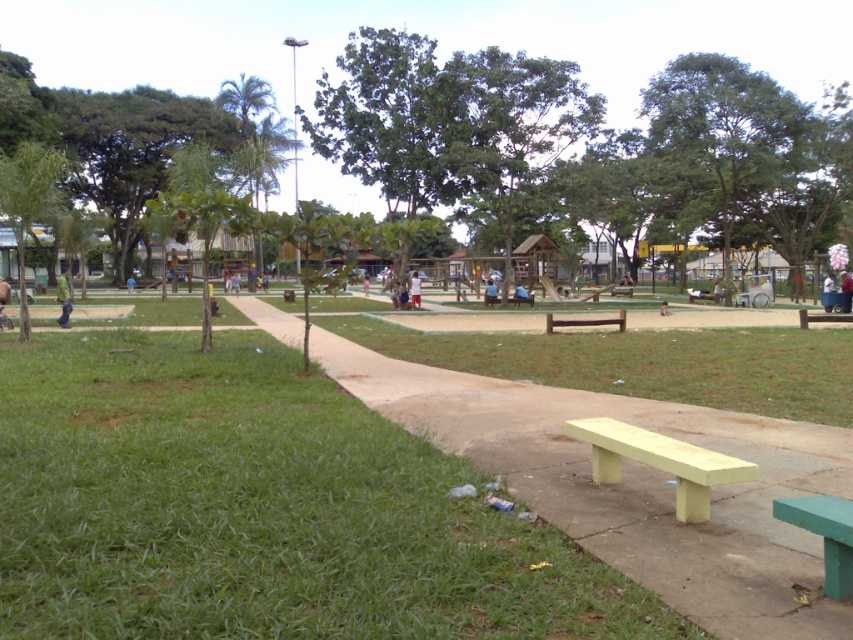
You are a park visitor trying to find a bench to sit down. You see the yellow wood bench at center and the yellow painted wood bench at lower right. Which bench is located to the left side of the other?

The yellow wood bench at center is to the left of yellow painted wood bench at lower right.